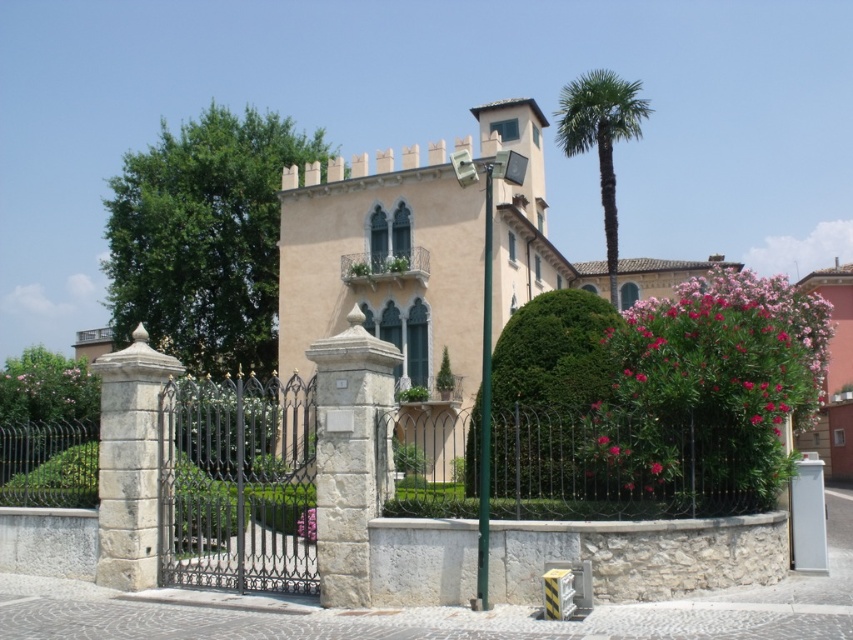
Question: Does pink matte flower at right come in front of pink matte flower at center right?

Choices:
 (A) no
 (B) yes

Answer: (A)

Question: Among these points, which one is farthest from the camera?

Choices:
 (A) (303, 516)
 (B) (584, 129)
 (C) (175, 445)
 (D) (223, 116)

Answer: (D)

Question: Can you confirm if green metallic pole at center is bigger than pink matte flower at center right?

Choices:
 (A) yes
 (B) no

Answer: (A)

Question: Which object is the closest to the pink matte flower at center right?

Choices:
 (A) green textured hedge at center
 (B) green leafy tree at upper left
 (C) pink matte flower at center
 (D) pink matte flower at center-right

Answer: (D)

Question: Among these points, which one is farthest from the camera?

Choices:
 (A) (486, 308)
 (B) (612, 104)
 (C) (303, 536)
 (D) (569, 312)

Answer: (B)

Question: Is green textured hedge at center above pink matte flower at center-right?

Choices:
 (A) no
 (B) yes

Answer: (B)